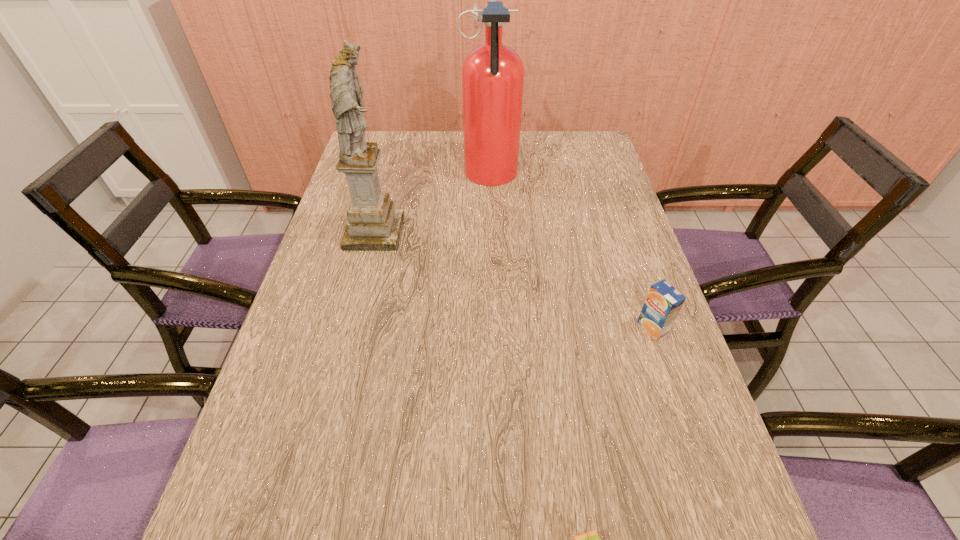
Image resolution: width=960 pixels, height=540 pixels. Find the location of `free space between the third object from right to left and the taller orange juice`. free space between the third object from right to left and the taller orange juice is located at coordinates (571, 252).

Select which object is the closest to the leftmost object. Please provide its 2D coordinates. Your answer should be formatted as a tuple, i.e. [(x, y)], where the tuple contains the x and y coordinates of a point satisfying the conditions above.

[(493, 73)]

Identify which object is the closest to the shortest object. Please provide its 2D coordinates. Your answer should be formatted as a tuple, i.e. [(x, y)], where the tuple contains the x and y coordinates of a point satisfying the conditions above.

[(663, 303)]

Where is `vacant region that satisfies the following two spatial constraints: 1. on the front-facing side of the sculpture; 2. on the back side of the second shortest object`? This screenshot has width=960, height=540. vacant region that satisfies the following two spatial constraints: 1. on the front-facing side of the sculpture; 2. on the back side of the second shortest object is located at coordinates (350, 328).

You are a GUI agent. You are given a task and a screenshot of the screen. Output one action in this format:
    pyautogui.click(x=<x>, y=<y>)
    Task: Click on the vacant point that satisfies the following two spatial constraints: 1. on the back side of the third farthest object; 2. on the front-facing side of the second farthest object
    
    Given the screenshot: What is the action you would take?
    coord(620,233)